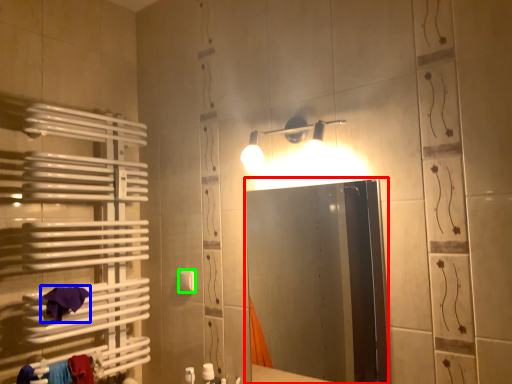
Question: Which is nearer to the mirror (highlighted by a red box)? bath towel (highlighted by a blue box) or towel bar (highlighted by a green box).

Choices:
 (A) bath towel
 (B) towel bar

Answer: (B)